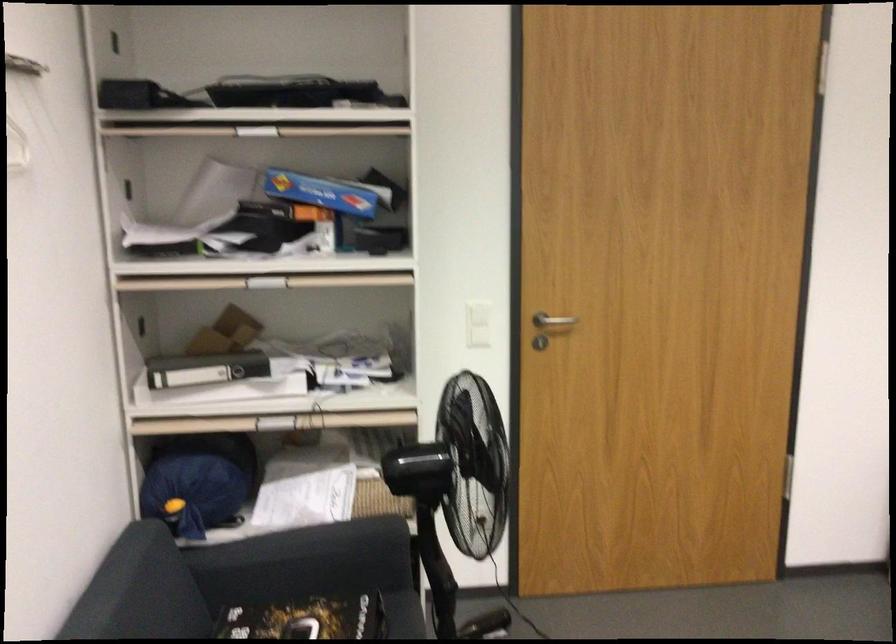
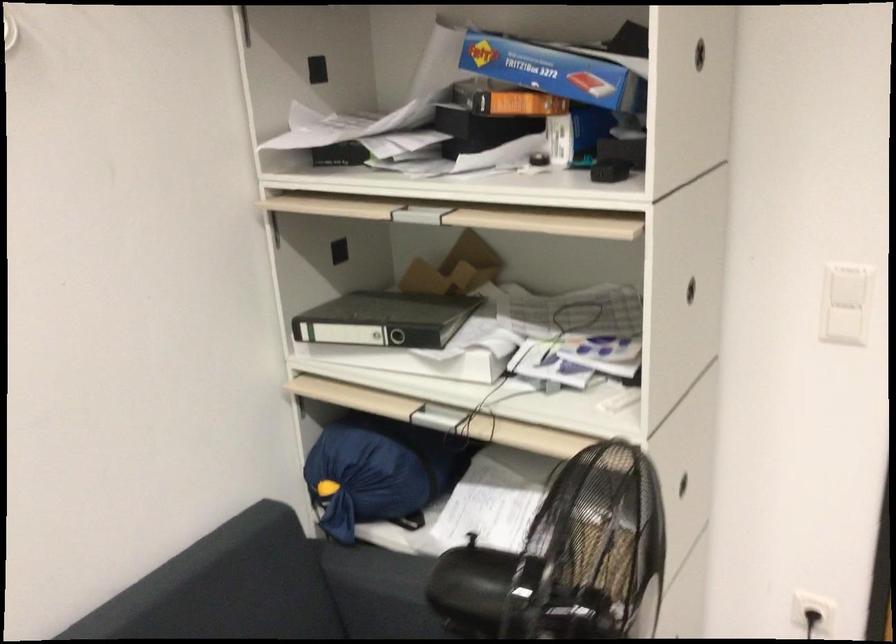
In the second image, find the point that corresponds to (x=383, y=250) in the first image.

(608, 171)